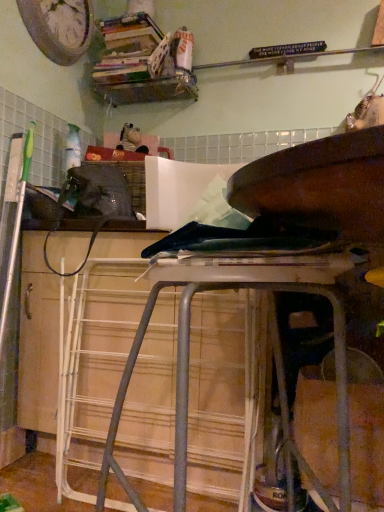
Question: Considering the relative sizes of metallic silver stool at center and wooden clock at upper left in the image provided, is metallic silver stool at center smaller than wooden clock at upper left?

Choices:
 (A) no
 (B) yes

Answer: (A)

Question: Could you tell me if metallic silver stool at center is turned towards wooden clock at upper left?

Choices:
 (A) no
 (B) yes

Answer: (A)

Question: Is metallic silver stool at center with wooden clock at upper left?

Choices:
 (A) yes
 (B) no

Answer: (B)

Question: Considering the relative positions of metallic silver stool at center and wooden clock at upper left in the image provided, is metallic silver stool at center to the left of wooden clock at upper left from the viewer's perspective?

Choices:
 (A) yes
 (B) no

Answer: (B)

Question: Is the position of metallic silver stool at center more distant than that of wooden clock at upper left?

Choices:
 (A) no
 (B) yes

Answer: (A)

Question: Is metallic silver stool at center bigger than wooden clock at upper left?

Choices:
 (A) yes
 (B) no

Answer: (A)

Question: Does wooden bookshelf at upper center come in front of metallic silver stool at center?

Choices:
 (A) no
 (B) yes

Answer: (A)

Question: Can we say wooden bookshelf at upper center lies outside metallic silver stool at center?

Choices:
 (A) yes
 (B) no

Answer: (A)

Question: From the image's perspective, does wooden bookshelf at upper center appear lower than metallic silver stool at center?

Choices:
 (A) yes
 (B) no

Answer: (B)

Question: Is wooden bookshelf at upper center positioned with its back to metallic silver stool at center?

Choices:
 (A) yes
 (B) no

Answer: (B)

Question: Considering the relative sizes of wooden bookshelf at upper center and metallic silver stool at center in the image provided, is wooden bookshelf at upper center shorter than metallic silver stool at center?

Choices:
 (A) yes
 (B) no

Answer: (A)

Question: Is wooden bookshelf at upper center at the right side of metallic silver stool at center?

Choices:
 (A) no
 (B) yes

Answer: (A)

Question: Is metallic silver stool at center with wooden bookshelf at upper center?

Choices:
 (A) no
 (B) yes

Answer: (A)